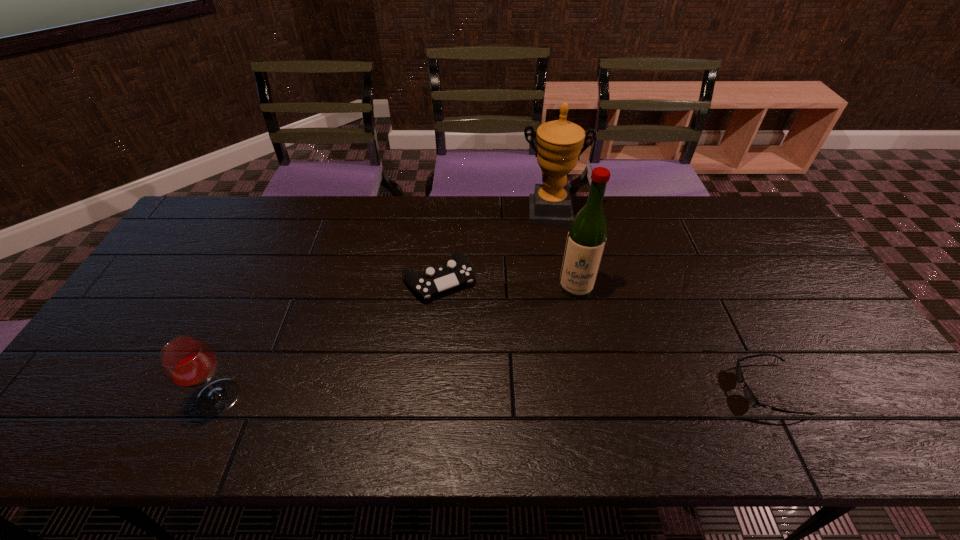
Where is `vacant space located 0.070m on the label of the liquor`? The width and height of the screenshot is (960, 540). vacant space located 0.070m on the label of the liquor is located at coordinates (572, 318).

The height and width of the screenshot is (540, 960). What are the coordinates of `object located at the far edge` in the screenshot? It's located at pyautogui.click(x=559, y=142).

Find the location of a particular element. wineglass present at the near edge is located at coordinates [188, 361].

Where is `sunglasses located in the near edge section of the desktop`? sunglasses located in the near edge section of the desktop is located at coordinates (749, 395).

This screenshot has width=960, height=540. I want to click on vacant space at the far edge, so click(694, 196).

Image resolution: width=960 pixels, height=540 pixels. Identify the location of vacant space at the near edge. (586, 396).

What are the coordinates of `free spot at the right edge of the desktop` in the screenshot? It's located at (801, 286).

You are a GUI agent. You are given a task and a screenshot of the screen. Output one action in this format:
    pyautogui.click(x=<x>, y=<y>)
    Task: Click on the free space at the far right corner
    
    Given the screenshot: What is the action you would take?
    pyautogui.click(x=740, y=205)

Where is `vacant space at the near right corner`? vacant space at the near right corner is located at coordinates (882, 380).

What are the coordinates of `vacant space in between the sunglasses and the control` in the screenshot? It's located at (603, 334).